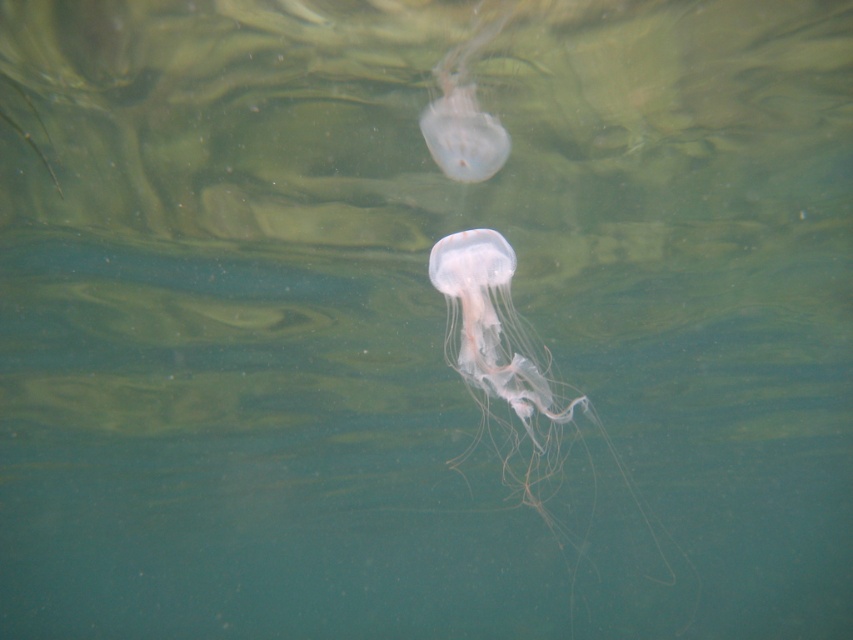
Who is shorter, translucent gelatinous at center or translucent gelatinous at upper center?

translucent gelatinous at upper center is shorter.

Is point (469, 312) less distant than point (461, 67)?

Yes, it is in front of point (461, 67).

Find the location of a particular element. This screenshot has height=640, width=853. translucent gelatinous at center is located at coordinates (515, 384).